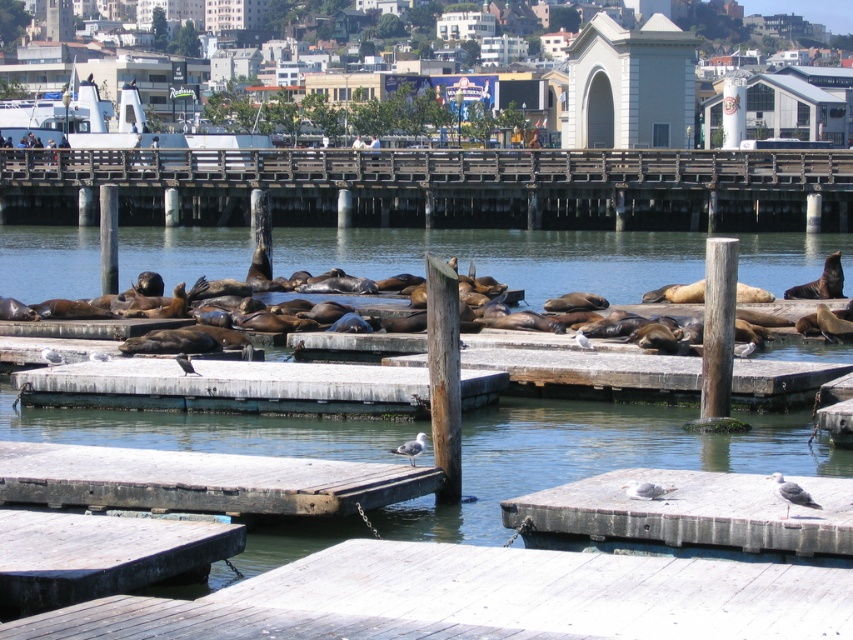
You are a photographer trying to capture the entire scene of the brown wooden water at center and the white wood dock at lower center in one shot. Based on their sizes, which object should you focus on to ensure both are visible without cropping?

The brown wooden water at center is bigger than the white wood dock at lower center, so focusing on the brown wooden water at center will allow both objects to be visible in the frame without cropping.

You are a delivery person who needs to unload heavy crates onto the concrete gray dock at lower right and the smooth concrete dock at center. Which dock should you choose if you want to place more crates without worrying about space?

The concrete gray dock at lower right is larger in size than the smooth concrete dock at center, so you should choose the concrete gray dock at lower right to place more crates without worrying about space.